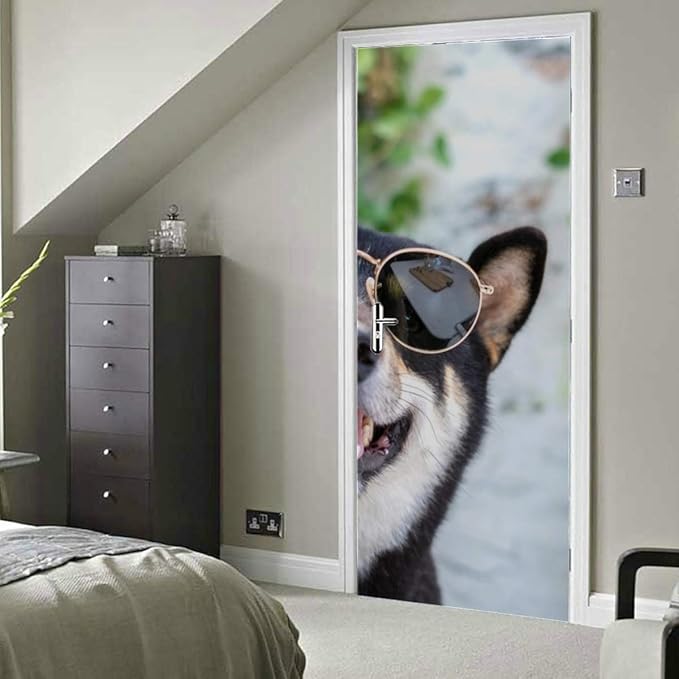
Where is `wall outlet`? This screenshot has width=679, height=679. wall outlet is located at coordinates (253, 519).